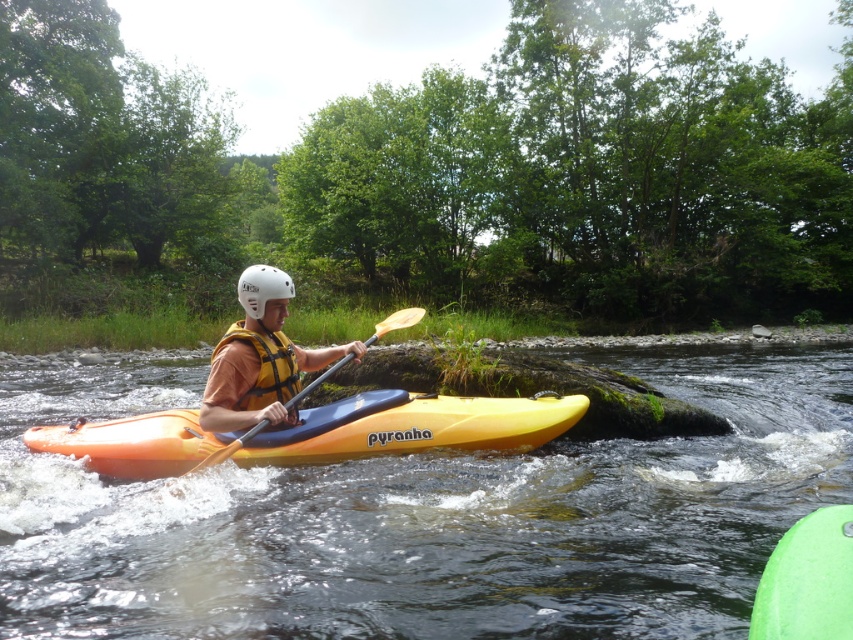
You are the kayaker in the image. You notice two points marked on the river ahead. The first point is at coordinates point (260, 296) and the second is at point (260, 344). Which point should you aim for if you want to navigate around the large rock ahead?

You should aim for point (260, 296) because it is in front of point (260, 344), allowing you to navigate around the large rock ahead more effectively.

You are a GPS system in a kayak race. The starting point is at coordinate 0.5, 0.3. The finish line is at 0.6, 0.3. The yellow matte kayak at center is your current position. Which direction should you paddle to reach the finish line?

The yellow matte kayak at center is at coordinate [260,358]. The finish line is at [254,384]. To reach the finish line, you should paddle slightly to the right and slightly forward since the finish line is slightly to the east and slightly south of the current position.

You are a photographer trying to capture the kayaks in the image. Since you want to focus on the taller kayak, which one should you choose between the orange plastic kayak at center and the yellow matte kayak at center?

The yellow matte kayak at center is taller than the orange plastic kayak at center, so you should focus on the yellow matte kayak at center.